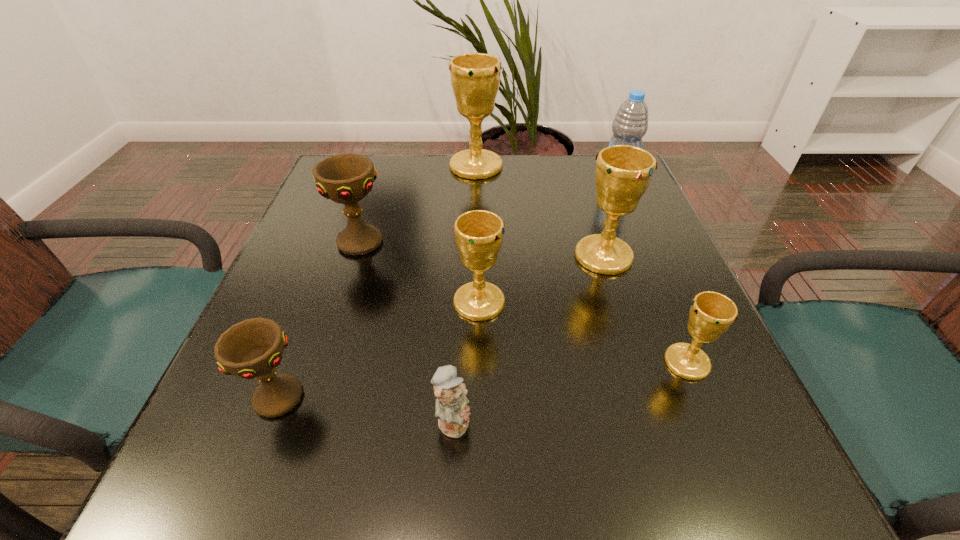
You are a GUI agent. You are given a task and a screenshot of the screen. Output one action in this format:
    pyautogui.click(x=<x>, y=<y>)
    Task: Click on the tallest chalice
    Image resolution: width=960 pixels, height=540 pixels.
    Given the screenshot: What is the action you would take?
    click(475, 77)

The width and height of the screenshot is (960, 540). I want to click on the farthest gold chalice, so click(475, 77).

Find the location of a particular element. blue water bottle is located at coordinates (630, 124).

Where is `the fifth shortest chalice`? the fifth shortest chalice is located at coordinates (623, 173).

This screenshot has width=960, height=540. I want to click on the second farthest gold chalice, so click(623, 173).

What are the coordinates of `the farther red chalice` in the screenshot? It's located at (343, 178).

Where is `the third biggest gold chalice`? This screenshot has width=960, height=540. the third biggest gold chalice is located at coordinates (479, 234).

Find the location of a particular element. the second nearest gold chalice is located at coordinates (479, 234).

The width and height of the screenshot is (960, 540). What are the coordinates of `the smaller red chalice` in the screenshot? It's located at click(x=253, y=348).

This screenshot has height=540, width=960. I want to click on the nearest gold chalice, so click(711, 314).